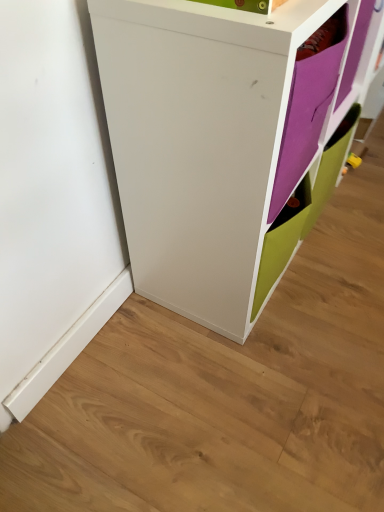
The width and height of the screenshot is (384, 512). Identify the location of free space to the right of white matte cabinet at center. (347, 234).